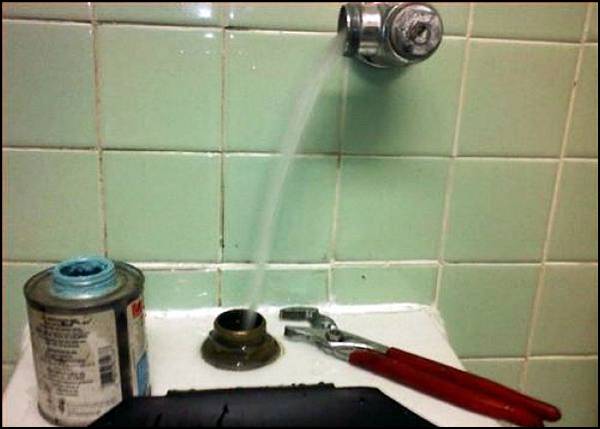
Locate an element on the screen. The image size is (600, 429). paint is located at coordinates (81, 269).